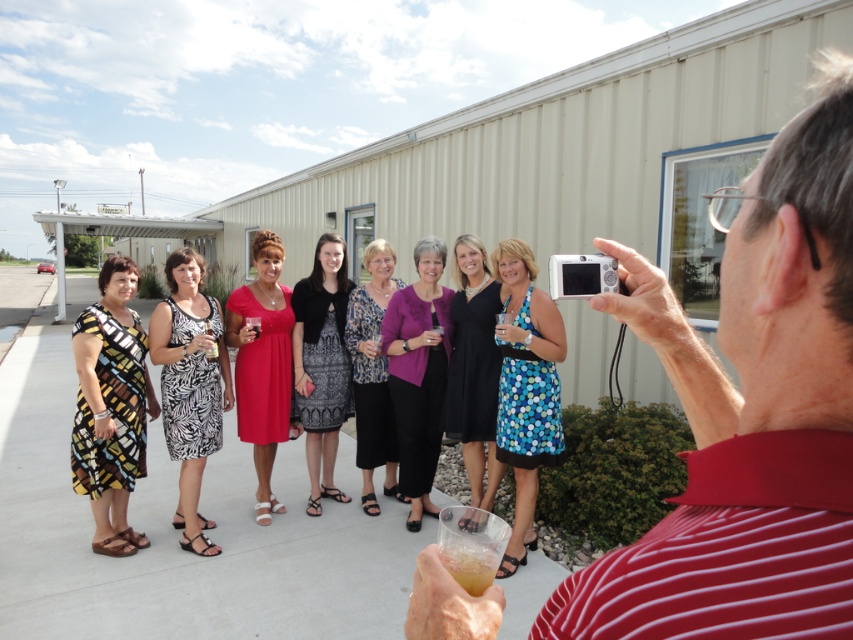
Question: Estimate the real-world distances between objects in this image. Which object is farther from the zebra print dress at center?

Choices:
 (A) purple matte cardigan at center
 (B) patterned fabric dress at center

Answer: (A)

Question: Is patterned fabric dress at center wider than translucent plastic cup at lower center?

Choices:
 (A) no
 (B) yes

Answer: (B)

Question: Which point is closer to the camera taking this photo?

Choices:
 (A) (260, 365)
 (B) (448, 369)
 (C) (111, 477)

Answer: (C)

Question: Among these objects, which one is farthest from the camera?

Choices:
 (A) purple matte cardigan at center
 (B) zebra print dress at center
 (C) blue dotted dress at center

Answer: (A)

Question: Can you confirm if printed fabric dress at center is wider than translucent plastic cup at lower center?

Choices:
 (A) yes
 (B) no

Answer: (A)

Question: Does zebra print dress at center have a smaller size compared to matte red dress at center?

Choices:
 (A) no
 (B) yes

Answer: (A)